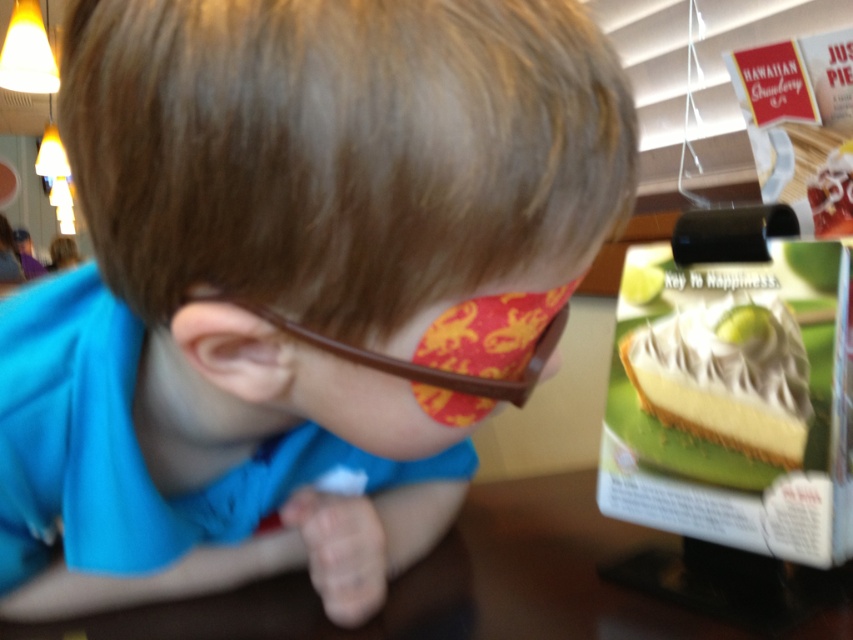
The child is wearing a blue fabric shirt at center and brown plastic glasses at center. Which item is wider?

The blue fabric shirt at center is wider than the brown plastic glasses at center.

You are a photographer trying to capture the child in the scene. Since the blue fabric shirt at center and the white creamy cake at right are both in the frame, which object should you focus on to ensure the child is in sharp focus?

The blue fabric shirt at center is closer to the viewer than the white creamy cake at right, so focusing on the blue fabric shirt at center will ensure the child is in sharp focus.